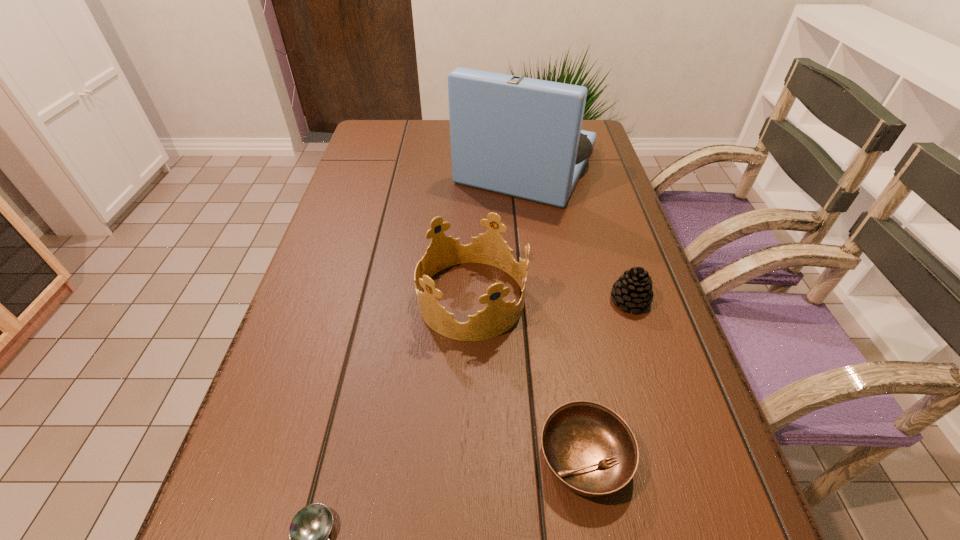
You are a GUI agent. You are given a task and a screenshot of the screen. Output one action in this format:
    pyautogui.click(x=<x>, y=<y>)
    Task: Click on the vacant space that is in between the soup bowl and the fourth shortest object
    The width and height of the screenshot is (960, 540).
    Given the screenshot: What is the action you would take?
    [527, 379]

Where is `free area in between the phonograph record and the soup bowl`? Image resolution: width=960 pixels, height=540 pixels. free area in between the phonograph record and the soup bowl is located at coordinates click(x=556, y=312).

The image size is (960, 540). In order to click on free space between the second tallest object and the third shortest object in this screenshot , I will do `click(550, 300)`.

The height and width of the screenshot is (540, 960). What are the coordinates of `free space between the third shortest object and the tiara` in the screenshot? It's located at (550, 300).

Identify the location of object that stands as the fourth closest to the fourth shortest object. (309, 530).

Identify which object is located as the second nearest to the nearest object. Please provide its 2D coordinates. Your answer should be formatted as a tuple, i.e. [(x, y)], where the tuple contains the x and y coordinates of a point satisfying the conditions above.

[(489, 248)]

Identify the location of free location that satisfies the following two spatial constraints: 1. on the front-facing side of the tiara; 2. on the right side of the second nearest object. (467, 458).

You are a GUI agent. You are given a task and a screenshot of the screen. Output one action in this format:
    pyautogui.click(x=<x>, y=<y>)
    Task: Click on the free space in the image that satisfies the following two spatial constraints: 1. on the front-facing side of the fourth tallest object; 2. on the left side of the tiara
    The image size is (960, 540).
    Given the screenshot: What is the action you would take?
    pyautogui.click(x=467, y=458)

The width and height of the screenshot is (960, 540). In order to click on vacant area that satisfies the following two spatial constraints: 1. on the front-facing side of the tiara; 2. on the left side of the second nearest object in this screenshot , I will do `click(467, 458)`.